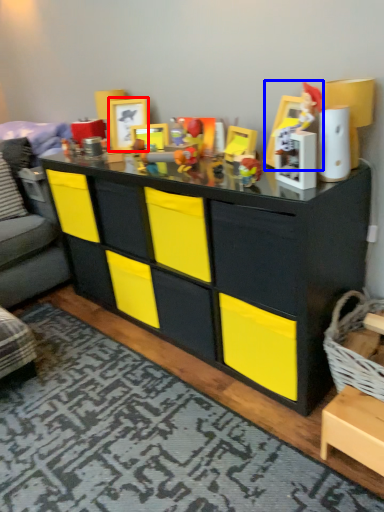
Question: Which object is closer to the camera taking this photo, picture frame (highlighted by a red box) or toy (highlighted by a blue box)?

Choices:
 (A) picture frame
 (B) toy

Answer: (B)